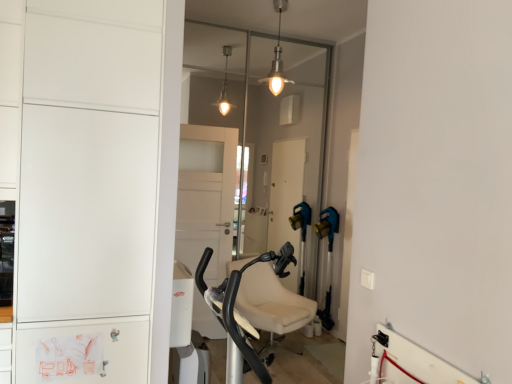
Question: Considering the relative sizes of white matte cabinet at left and metallic pendant light at upper center in the image provided, is white matte cabinet at left thinner than metallic pendant light at upper center?

Choices:
 (A) no
 (B) yes

Answer: (A)

Question: Is white matte cabinet at left bigger than metallic pendant light at upper center?

Choices:
 (A) yes
 (B) no

Answer: (A)

Question: Considering the relative sizes of white matte cabinet at left and metallic pendant light at upper center in the image provided, is white matte cabinet at left shorter than metallic pendant light at upper center?

Choices:
 (A) no
 (B) yes

Answer: (A)

Question: Does white matte cabinet at left have a smaller size compared to metallic pendant light at upper center?

Choices:
 (A) no
 (B) yes

Answer: (A)

Question: Can you confirm if white matte cabinet at left is positioned to the left of metallic pendant light at upper center?

Choices:
 (A) no
 (B) yes

Answer: (B)

Question: Would you consider white matte cabinet at left to be distant from metallic pendant light at upper center?

Choices:
 (A) no
 (B) yes

Answer: (B)

Question: Are metallic pendant light at upper center and white matte cabinet at left making contact?

Choices:
 (A) no
 (B) yes

Answer: (A)

Question: Considering the relative sizes of metallic pendant light at upper center and white matte cabinet at left in the image provided, is metallic pendant light at upper center wider than white matte cabinet at left?

Choices:
 (A) yes
 (B) no

Answer: (B)

Question: Does metallic pendant light at upper center appear on the right side of white matte cabinet at left?

Choices:
 (A) no
 (B) yes

Answer: (B)

Question: Would you say metallic pendant light at upper center is outside white matte cabinet at left?

Choices:
 (A) yes
 (B) no

Answer: (A)

Question: Does metallic pendant light at upper center lie behind white matte cabinet at left?

Choices:
 (A) no
 (B) yes

Answer: (B)

Question: From a real-world perspective, is metallic pendant light at upper center over white matte cabinet at left?

Choices:
 (A) yes
 (B) no

Answer: (A)

Question: Can you confirm if transparent glass door at center is smaller than white matte cabinet at left?

Choices:
 (A) no
 (B) yes

Answer: (B)